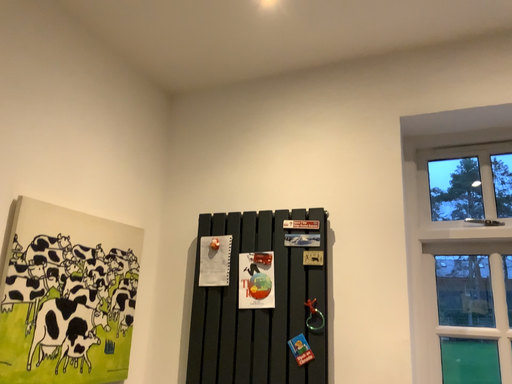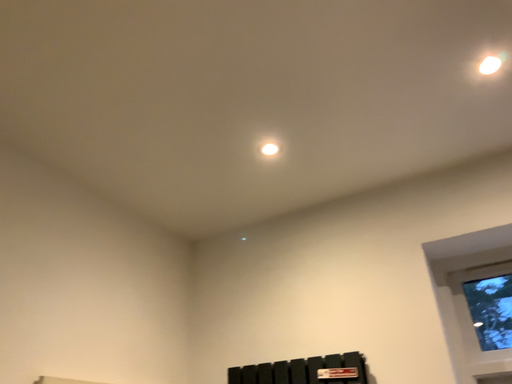
Question: How did the camera likely rotate when shooting the video?

Choices:
 (A) rotated upward
 (B) rotated downward

Answer: (A)